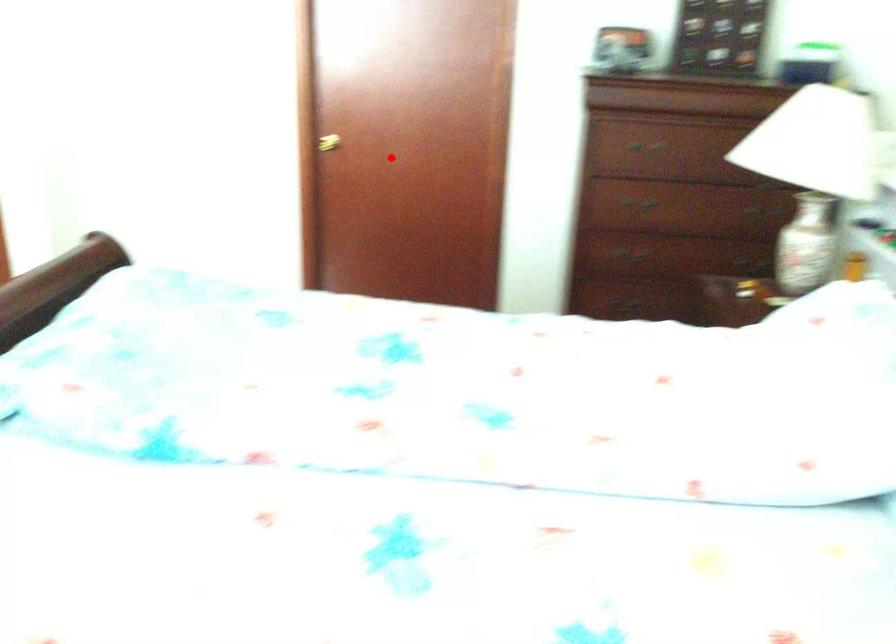
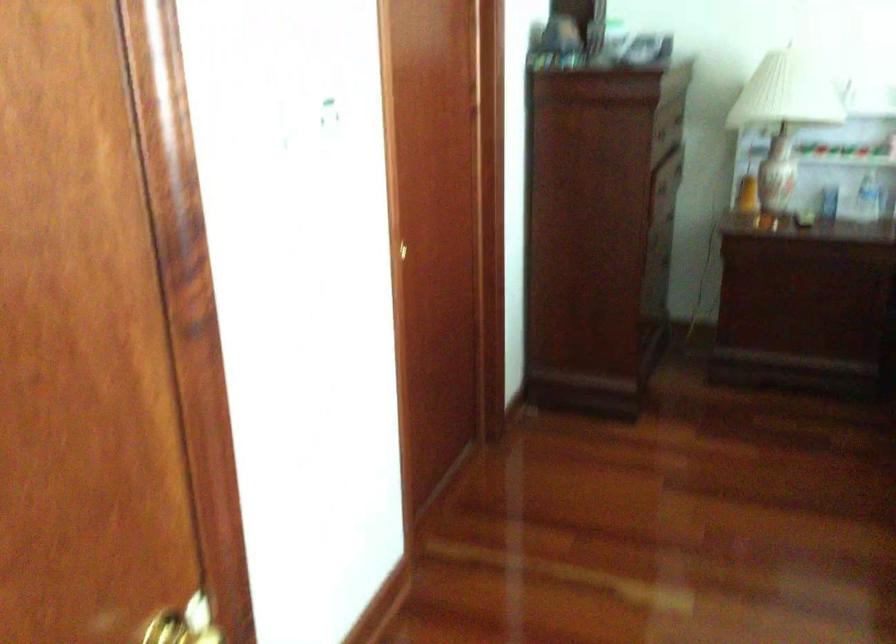
Locate, in the second image, the point that corresponds to the highlighted location in the first image.

(408, 250)